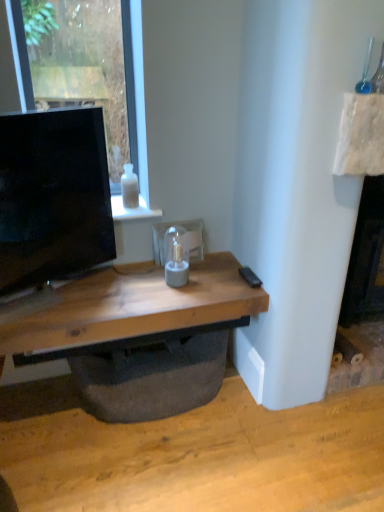
This screenshot has height=512, width=384. Describe the element at coordinates (250, 277) in the screenshot. I see `black plastic remote at lower right` at that location.

What do you see at coordinates (129, 187) in the screenshot? I see `transparent glass bottle at upper center` at bounding box center [129, 187].

The height and width of the screenshot is (512, 384). Identify the location of white glass bottle at upper center. (132, 210).

Find the location of `matte black tv at left`. matte black tv at left is located at coordinates (53, 197).

Is transparent glass bottle at upper center wider or thinner than wooden desk at center?

Clearly, transparent glass bottle at upper center has less width compared to wooden desk at center.

Locate an element on the screen. The width and height of the screenshot is (384, 512). computer desk that appears on the right of transparent glass bottle at upper center is located at coordinates (140, 338).

Does transparent glass bottle at upper center come in front of wooden desk at center?

No, transparent glass bottle at upper center is further to the viewer.

Does white glass bottle at upper center lie in front of matte black tv at left?

No, white glass bottle at upper center is behind matte black tv at left.

Where is `television below the white glass bottle at upper center (from the image's perspective)`? This screenshot has height=512, width=384. television below the white glass bottle at upper center (from the image's perspective) is located at coordinates (53, 197).

Is point (146, 207) farther from camera compared to point (62, 272)?

That is True.

Is white glass bottle at upper center at the right side of matte black tv at left?

Yes, white glass bottle at upper center is to the right of matte black tv at left.

Between wooden desk at center and white glass bottle at upper center, which one appears on the right side from the viewer's perspective?

From the viewer's perspective, wooden desk at center appears more on the right side.

Who is more distant, wooden desk at center or white glass bottle at upper center?

white glass bottle at upper center is behind.

In the scene shown: Is wooden desk at center not near white glass bottle at upper center?

wooden desk at center is actually quite close to white glass bottle at upper center.

In terms of size, does wooden desk at center appear bigger or smaller than white glass bottle at upper center?

Considering their sizes, wooden desk at center takes up more space than white glass bottle at upper center.

From a real-world perspective, is matte black tv at left over black plastic remote at lower right?

Indeed, from a real-world perspective, matte black tv at left stands above black plastic remote at lower right.

Between matte black tv at left and black plastic remote at lower right, which one has smaller size?

Smaller between the two is black plastic remote at lower right.

Is matte black tv at left situated inside black plastic remote at lower right or outside?

matte black tv at left is not inside black plastic remote at lower right, it's outside.

Can you tell me how much wooden desk at center and transparent glass bottle at upper center differ in facing direction?

There is a 2.67-degree angle between the facing directions of wooden desk at center and transparent glass bottle at upper center.

Is wooden desk at center positioned behind transparent glass bottle at upper center?

That is False.

In the image, is wooden desk at center on the left side or the right side of transparent glass bottle at upper center?

wooden desk at center is positioned on transparent glass bottle at upper center's right side.

In the image, there is a wooden desk at center. Identify the location of bottle above it (from the image's perspective). The image size is (384, 512). (129, 187).

Can you confirm if transparent glass bottle at upper center is taller than matte black tv at left?

In fact, transparent glass bottle at upper center may be shorter than matte black tv at left.

Consider the image. Does transparent glass bottle at upper center have a smaller size compared to matte black tv at left?

Yes, transparent glass bottle at upper center is smaller than matte black tv at left.

Considering the sizes of transparent glass bottle at upper center and matte black tv at left in the image, is transparent glass bottle at upper center wider or thinner than matte black tv at left?

In the image, transparent glass bottle at upper center appears to be more narrow than matte black tv at left.

Can you tell me how much transparent glass bottle at upper center and matte black tv at left differ in facing direction?

The angular difference between transparent glass bottle at upper center and matte black tv at left is 21.4 degrees.

Are transparent glass bottle at upper center and transparent glass window at upper left located far from each other?

That's not correct — transparent glass bottle at upper center is a little close to transparent glass window at upper left.

In terms of width, does transparent glass bottle at upper center look wider or thinner when compared to transparent glass window at upper left?

In the image, transparent glass bottle at upper center appears to be wider than transparent glass window at upper left.

Which object is more forward, transparent glass bottle at upper center or transparent glass window at upper left?

Positioned in front is transparent glass window at upper left.

Is transparent glass window at upper left at the back of transparent glass bottle at upper center?

Correct, transparent glass bottle at upper center is looking away from transparent glass window at upper left.

The height and width of the screenshot is (512, 384). What are the coordinates of `bottle behind the wooden desk at center` in the screenshot? It's located at (129, 187).

The image size is (384, 512). In order to click on window sill beneath the matte black tv at left (from a real-world perspective) in this screenshot , I will do `click(132, 210)`.

Considering their positions, is transparent glass bottle at upper center positioned further to wooden desk at center than transparent glass window at upper left?

The object further to wooden desk at center is transparent glass window at upper left.

Based on their spatial positions, is white glass bottle at upper center or transparent glass window at upper left further from wooden desk at center?

The object further to wooden desk at center is transparent glass window at upper left.

Considering their positions, is wooden desk at center positioned closer to white glass bottle at upper center than transparent glass window at upper left?

transparent glass window at upper left lies closer to white glass bottle at upper center than the other object.

From the image, which object appears to be farther from white glass bottle at upper center, black plastic remote at lower right or transparent glass bottle at upper center?

Based on the image, black plastic remote at lower right appears to be further to white glass bottle at upper center.

When comparing their distances from wooden desk at center, does black plastic remote at lower right or transparent glass bottle at upper center seem further?

The object further to wooden desk at center is transparent glass bottle at upper center.

When comparing their distances from transparent glass bottle at upper center, does matte black tv at left or transparent glass window at upper left seem further?

matte black tv at left.

From the image, which object appears to be farther from transparent glass window at upper left, transparent glass bottle at upper center or wooden desk at center?

wooden desk at center is positioned further to the anchor transparent glass window at upper left.

Estimate the real-world distances between objects in this image. Which object is closer to white glass bottle at upper center, transparent glass window at upper left or transparent glass bottle at upper center?

transparent glass bottle at upper center is positioned closer to the anchor white glass bottle at upper center.

You are a GUI agent. You are given a task and a screenshot of the screen. Output one action in this format:
    pyautogui.click(x=<x>, y=<y>)
    Task: Click on the window located between matte black tv at left and black plastic remote at lower right in the left-right direction
    The height and width of the screenshot is (512, 384).
    Given the screenshot: What is the action you would take?
    pyautogui.click(x=140, y=79)

The height and width of the screenshot is (512, 384). In order to click on window sill between matte black tv at left and black plastic remote at lower right in this screenshot , I will do `click(132, 210)`.

You are a GUI agent. You are given a task and a screenshot of the screen. Output one action in this format:
    pyautogui.click(x=<x>, y=<y>)
    Task: Click on the computer desk between matte black tv at left and transparent glass bottle at upper center from front to back
    Image resolution: width=384 pixels, height=512 pixels.
    Given the screenshot: What is the action you would take?
    pyautogui.click(x=140, y=338)

Where is `window positioned between matte black tv at left and transparent glass bottle at upper center from near to far`? This screenshot has height=512, width=384. window positioned between matte black tv at left and transparent glass bottle at upper center from near to far is located at coordinates (140, 79).